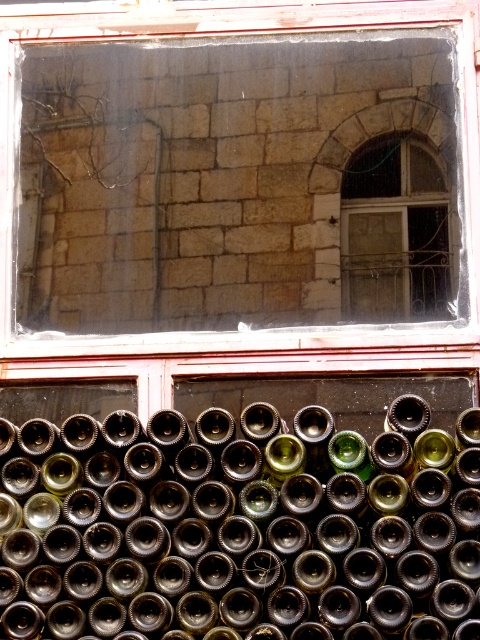
Question: Which of the following is the farthest from the observer?

Choices:
 (A) dark brown glass bottles at bottom
 (B) clear glass window at upper center

Answer: (B)

Question: From the image, what is the correct spatial relationship of clear glass window at upper center in relation to matte glass window at upper right?

Choices:
 (A) right
 (B) left

Answer: (B)

Question: Is clear glass window at upper center thinner than dark brown glass bottles at bottom?

Choices:
 (A) no
 (B) yes

Answer: (B)

Question: Based on their relative distances, which object is farther from the dark brown glass bottles at bottom?

Choices:
 (A) clear glass window at upper center
 (B) matte glass window at upper right

Answer: (A)

Question: Which point appears farthest from the camera in this image?

Choices:
 (A) (x=462, y=192)
 (B) (x=432, y=305)
 (C) (x=294, y=428)

Answer: (A)

Question: Is dark brown glass bottles at bottom smaller than matte glass window at upper right?

Choices:
 (A) no
 (B) yes

Answer: (A)